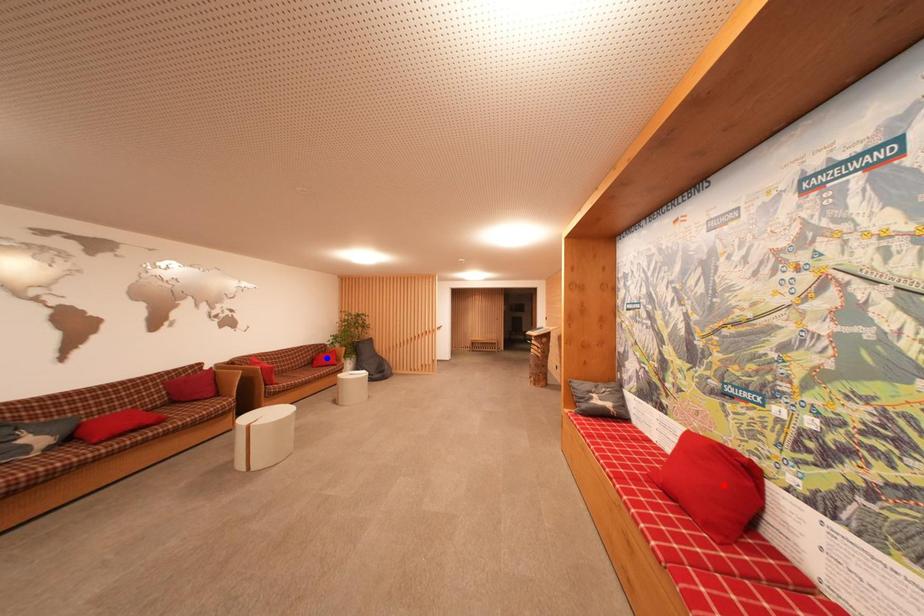
Question: In the image, two points are highlighted. Which point is nearer to the camera? Reply with the corresponding letter.

Choices:
 (A) blue point
 (B) red point

Answer: (B)